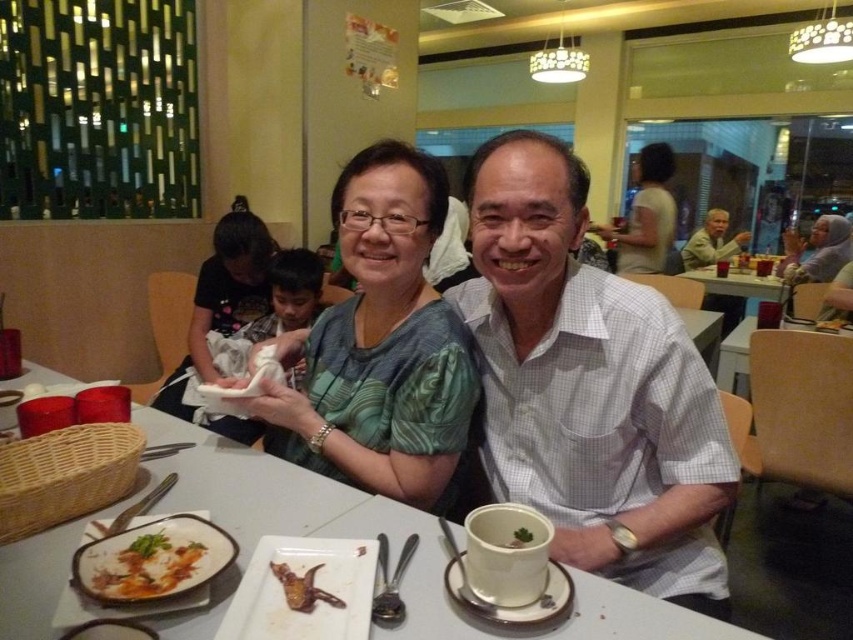
From the picture: You are a photographer standing behind the two people at the table. You want to take a photo of the white checkered shirt at center and the white glossy table at center without any obstruction. Given that your camera has a minimum focus distance of 15 inches, will you be able to capture both subjects clearly?

The white checkered shirt at center and the white glossy table at center are 14.96 inches apart. Since the distance between them is less than the camera minimum focus distance of 15 inches, the photographer will not be able to capture both subjects clearly without obstruction.

Based on the photo, you are a photographer standing at the center of the room. You want to take a photo of the green textured blouse at center. Based on its position, where should you aim your camera?

The green textured blouse at center is located at coordinates 0.547 on the x axis and 0.450 on the y axis, so you should aim your camera towards that point to capture it.

Looking at this image, you are a photographer setting up for a group photo. You notice the matte white shirt at upper center and the light brown wooden chair at right in your frame. Which object should you adjust to ensure both are in focus, considering their size in the frame?

The matte white shirt at upper center is smaller than the light brown wooden chair at right, so you should adjust the focus on the matte white shirt at upper center to ensure both are in focus.